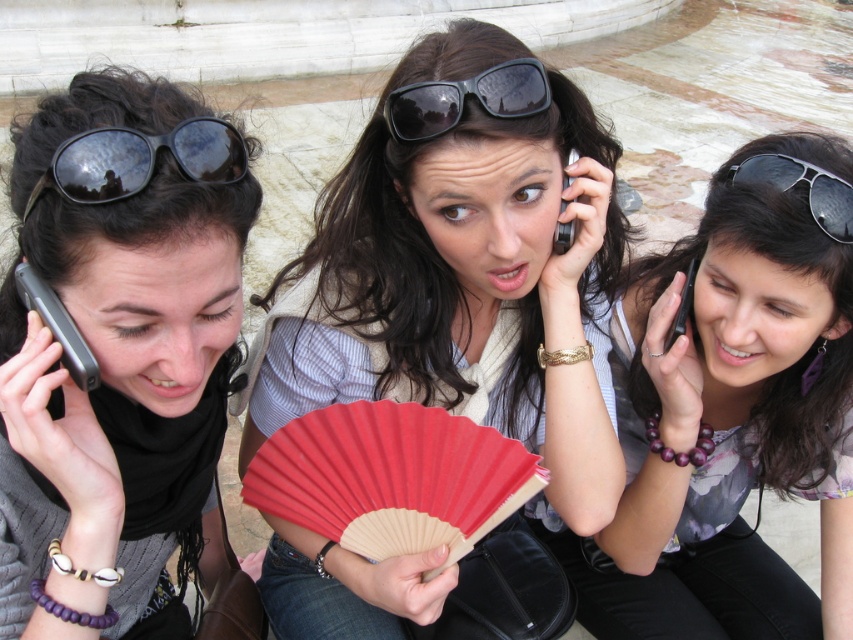
Question: Does matte red fan at center have a smaller size compared to purple beaded bracelet at center?

Choices:
 (A) no
 (B) yes

Answer: (B)

Question: Among these points, which one is nearest to the camera?

Choices:
 (A) (675, 312)
 (B) (532, 74)
 (C) (70, 250)

Answer: (C)

Question: Is matte red fan at center above black matte sunglasses at center?

Choices:
 (A) yes
 (B) no

Answer: (B)

Question: Which of these objects is positioned farthest from the black plastic phone at center?

Choices:
 (A) black aviator sunglasses at upper right
 (B) black matte sunglasses at center
 (C) matte red fan at center
 (D) black reflective sunglasses at upper left

Answer: (D)

Question: Is matte black sunglasses at upper left further to camera compared to metallic silver phone at center?

Choices:
 (A) yes
 (B) no

Answer: (B)

Question: Among these objects, which one is nearest to the camera?

Choices:
 (A) black plastic phone at center
 (B) metallic silver phone at center
 (C) black reflective sunglasses at upper left
 (D) matte black sunglasses at upper left

Answer: (C)